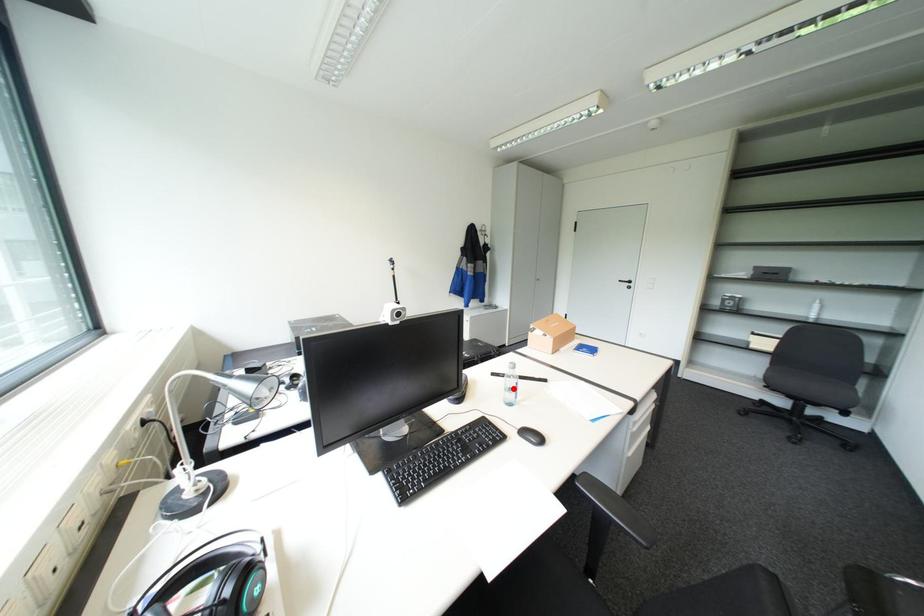
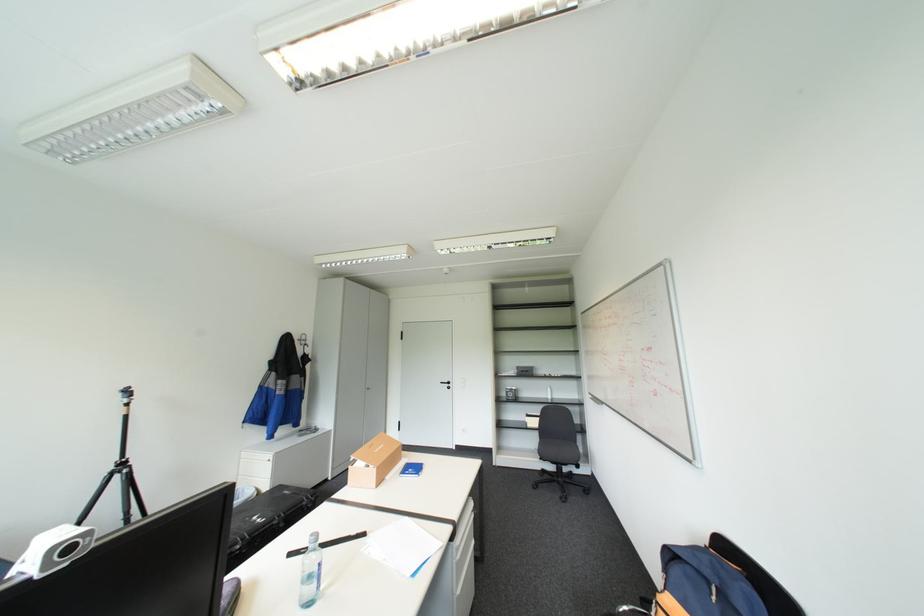
In the second image, find the point that corresponds to the highlighted location in the first image.

(310, 581)